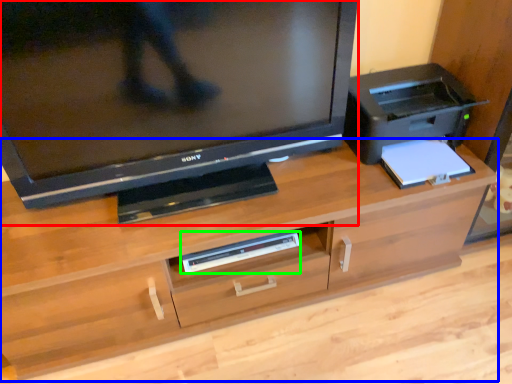
Question: Estimate the real-world distances between objects in this image. Which object is closer to television (highlighted by a red box), desk (highlighted by a blue box) or equipment (highlighted by a green box)?

Choices:
 (A) desk
 (B) equipment

Answer: (A)